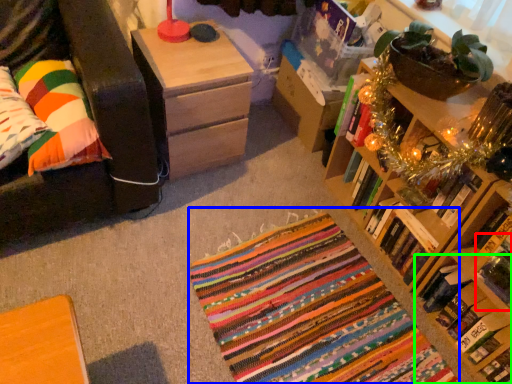
Question: Which is nearer to the book (highlighted by a red box)? yoga mat (highlighted by a blue box) or book (highlighted by a green box).

Choices:
 (A) yoga mat
 (B) book

Answer: (B)